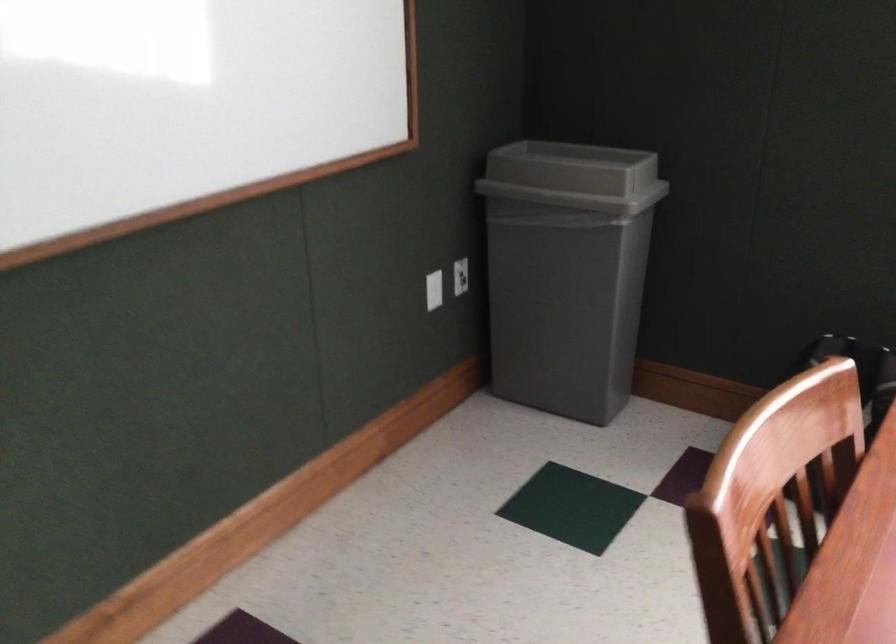
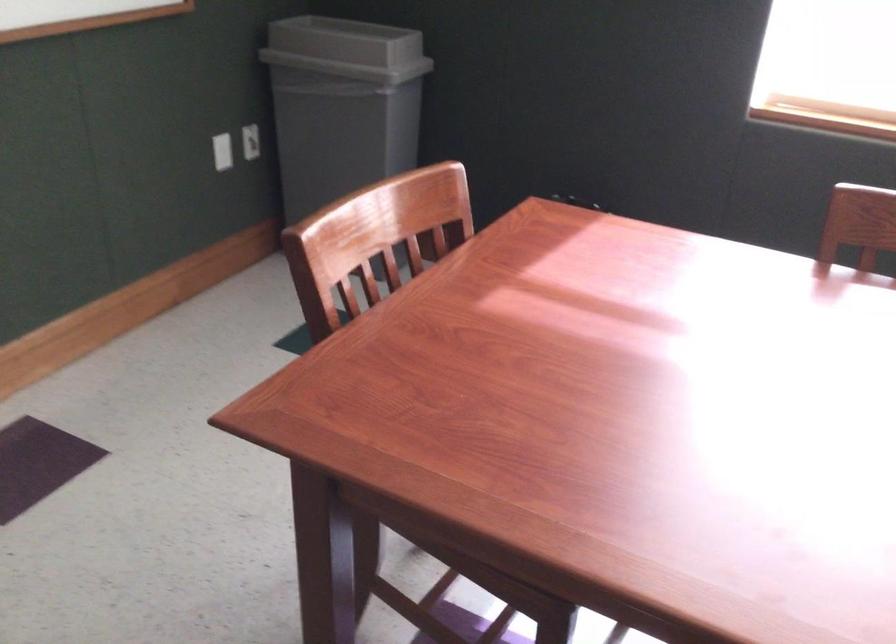
Question: The first image is from the beginning of the video and the second image is from the end. How did the camera likely rotate when shooting the video?

Choices:
 (A) Left
 (B) Right
 (C) Up
 (D) Down

Answer: (B)